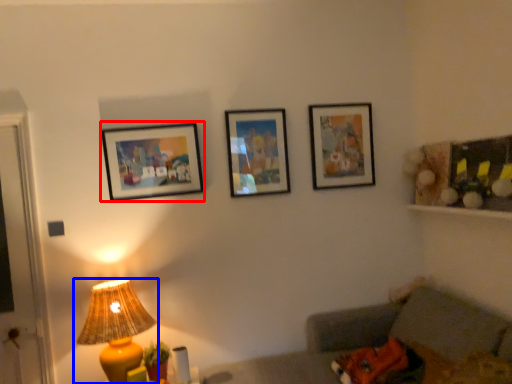
Question: Which object is closer to the camera taking this photo, picture frame (highlighted by a red box) or lamp (highlighted by a blue box)?

Choices:
 (A) picture frame
 (B) lamp

Answer: (B)